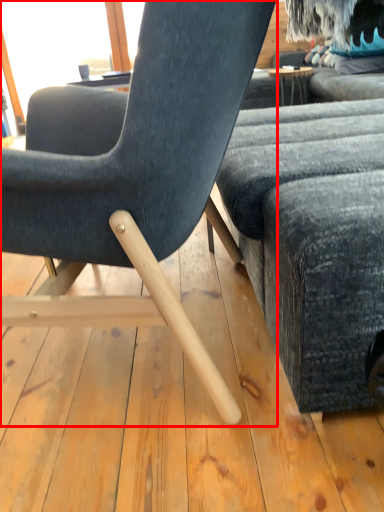
Question: From the image's perspective, what is the correct spatial relationship of chair (annotated by the red box) in relation to studio couch?

Choices:
 (A) below
 (B) above

Answer: (A)